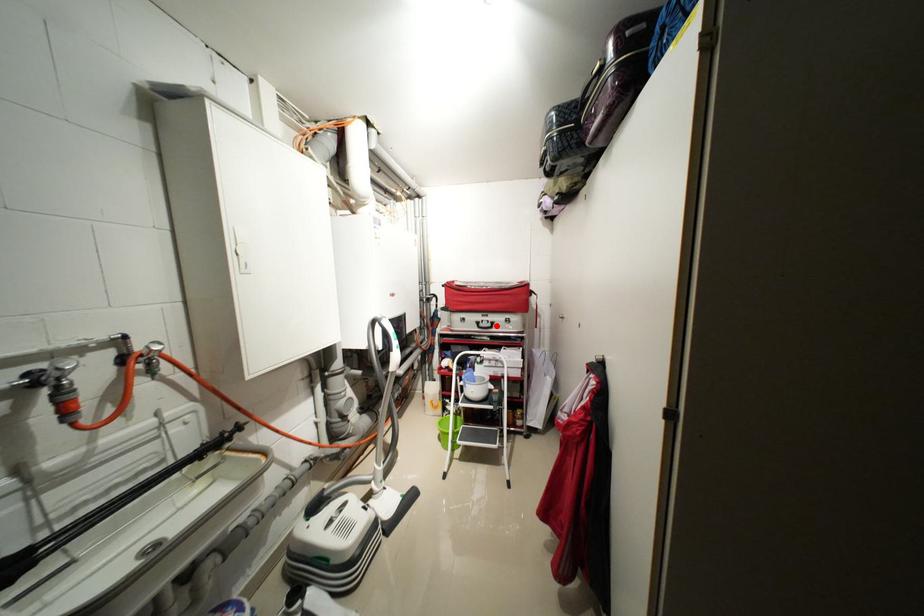
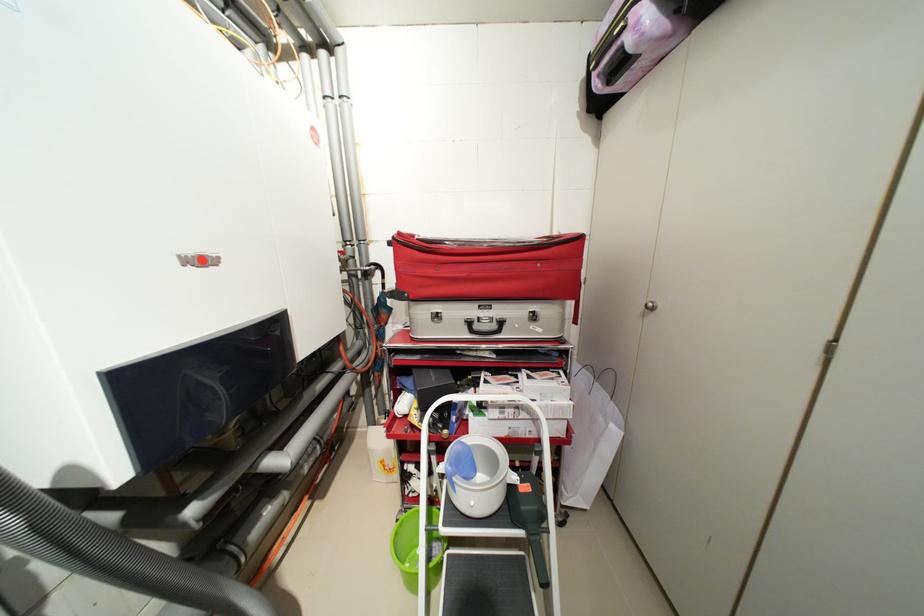
Where in the second image is the point corresponding to the highlighted location from the first image?

(502, 326)